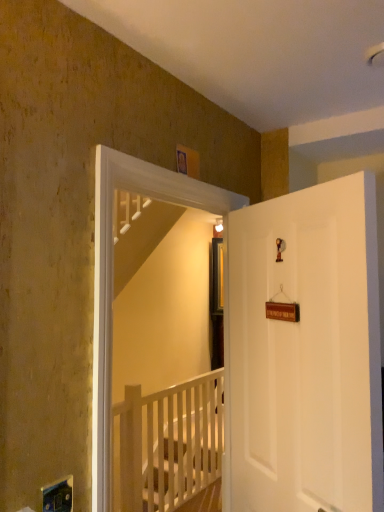
Question: Is white wooden screen door at upper center behind white matte door at right?

Choices:
 (A) yes
 (B) no

Answer: (A)

Question: Is white wooden screen door at upper center not within white matte door at right?

Choices:
 (A) yes
 (B) no

Answer: (A)

Question: Does white wooden screen door at upper center have a lesser height compared to white matte door at right?

Choices:
 (A) no
 (B) yes

Answer: (A)

Question: From the image's perspective, is white wooden screen door at upper center on white matte door at right?

Choices:
 (A) no
 (B) yes

Answer: (B)

Question: Does white wooden screen door at upper center appear on the left side of white matte door at right?

Choices:
 (A) yes
 (B) no

Answer: (A)

Question: From a real-world perspective, relative to white wooden rail at center, is white matte door at right vertically above or below?

Choices:
 (A) below
 (B) above

Answer: (B)

Question: Does point 243,345 appear closer or farther from the camera than point 178,398?

Choices:
 (A) closer
 (B) farther

Answer: (A)

Question: Is white matte door at right wider or thinner than white wooden rail at center?

Choices:
 (A) thin
 (B) wide

Answer: (A)

Question: Considering the positions of white matte door at right and white wooden rail at center in the image, is white matte door at right taller or shorter than white wooden rail at center?

Choices:
 (A) tall
 (B) short

Answer: (A)

Question: From the image's perspective, is white wooden screen door at upper center located above or below white matte door at right?

Choices:
 (A) above
 (B) below

Answer: (A)

Question: Do you think white wooden screen door at upper center is within white matte door at right, or outside of it?

Choices:
 (A) inside
 (B) outside

Answer: (B)

Question: From a real-world perspective, is white wooden screen door at upper center positioned above or below white matte door at right?

Choices:
 (A) below
 (B) above

Answer: (B)

Question: Considering the positions of white wooden screen door at upper center and white matte door at right in the image, is white wooden screen door at upper center taller or shorter than white matte door at right?

Choices:
 (A) tall
 (B) short

Answer: (A)

Question: Is white wooden screen door at upper center to the left or to the right of white wooden rail at center in the image?

Choices:
 (A) right
 (B) left

Answer: (A)

Question: Is white wooden screen door at upper center inside the boundaries of white wooden rail at center, or outside?

Choices:
 (A) outside
 (B) inside

Answer: (A)